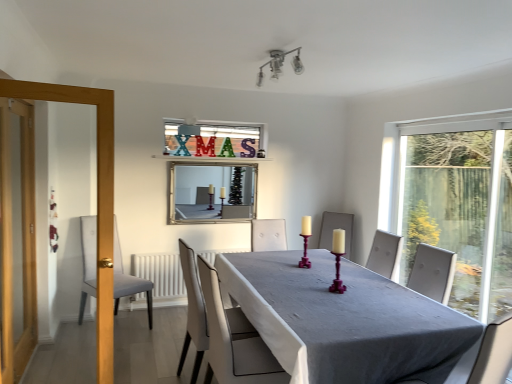
Locate an element on the screen. vacant space that is to the left of purple wood candle holder at center, positioned as the 1th candle holder in back-to-front order is located at coordinates (282, 268).